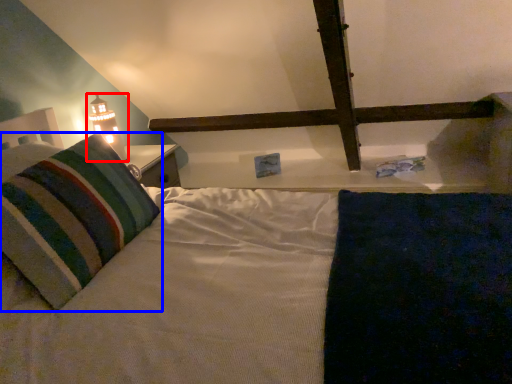
Question: Which of the following is the farthest to the observer, table lamp (highlighted by a red box) or pillow (highlighted by a blue box)?

Choices:
 (A) table lamp
 (B) pillow

Answer: (A)